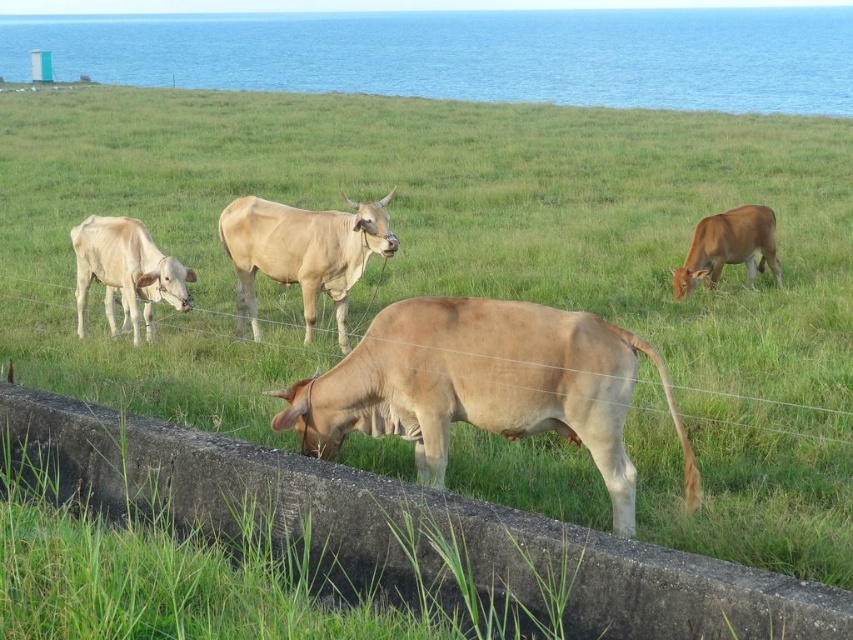
Question: Is light brown smooth cow at center below light brown cow at right?

Choices:
 (A) yes
 (B) no

Answer: (A)

Question: Which point is farther from the camera taking this photo?

Choices:
 (A) (531, 33)
 (B) (676, 273)
 (C) (386, 339)

Answer: (A)

Question: Which object appears farthest from the camera in this image?

Choices:
 (A) blue water at upper center
 (B) light beige cow at left
 (C) light brown cow at center
 (D) light brown cow at right

Answer: (A)

Question: Is light brown cow at center further to the viewer compared to light beige cow at left?

Choices:
 (A) yes
 (B) no

Answer: (B)

Question: Can you confirm if light brown smooth cow at center is thinner than light brown cow at center?

Choices:
 (A) no
 (B) yes

Answer: (A)

Question: Which of the following is the farthest from the observer?

Choices:
 (A) light beige cow at left
 (B) blue water at upper center
 (C) light brown smooth cow at center
 (D) light brown cow at center

Answer: (B)